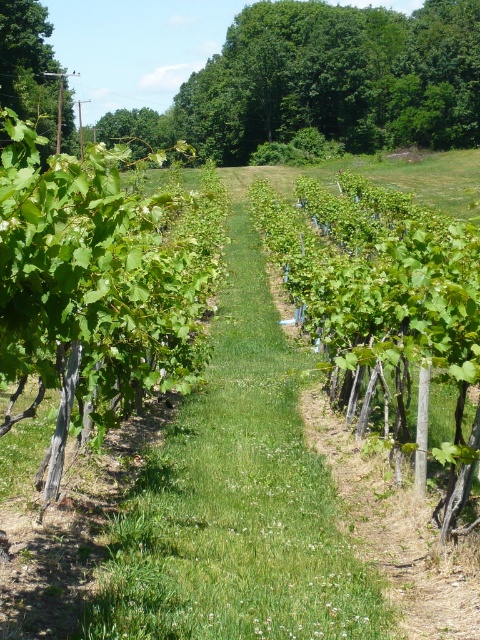
Does green leafy tree at upper center appear under green leafy tree at upper left?

No, green leafy tree at upper center is not below green leafy tree at upper left.

Who is shorter, green leafy tree at upper center or green leafy tree at upper left?

With less height is green leafy tree at upper center.

Image resolution: width=480 pixels, height=640 pixels. I want to click on green leafy tree at upper center, so click(x=325, y=81).

Where is `green leafy tree at upper center`? green leafy tree at upper center is located at coordinates (325, 81).